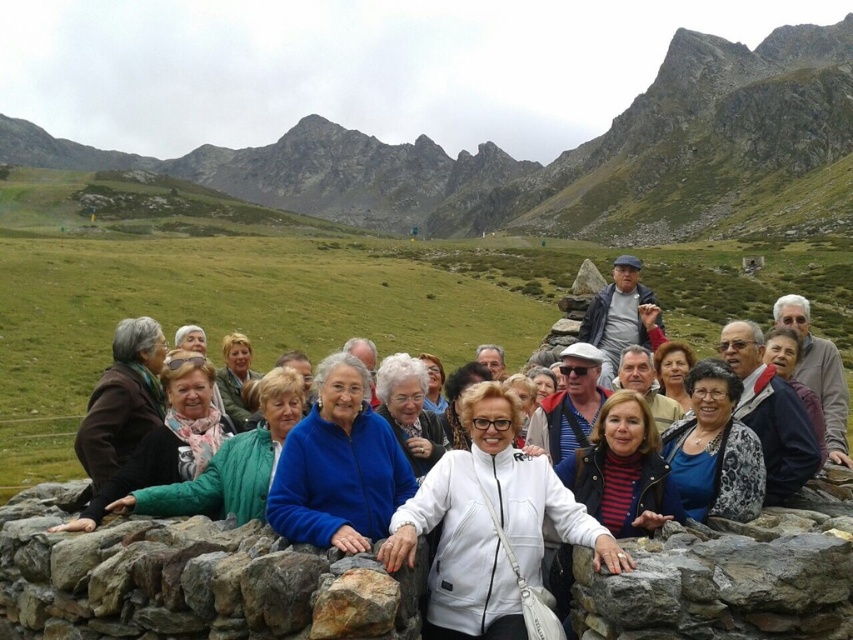
Is white matte jacket at center shorter than rough textured rock at center?

In fact, white matte jacket at center may be taller than rough textured rock at center.

Can you confirm if white matte jacket at center is smaller than rough textured rock at center?

No.

Where is `white matte jacket at center`? white matte jacket at center is located at coordinates (198, 586).

Based on the photo, between rough textured rock at center and gray rough stone at center, which one is positioned lower?

Positioned lower is gray rough stone at center.

Does point (97, 566) come in front of point (654, 572)?

No.

Identify the location of rough textured rock at center. (187, 580).

Is rugged stone mountain at center to the right of gray rough stone at center from the viewer's perspective?

No, rugged stone mountain at center is not to the right of gray rough stone at center.

Which is above, rugged stone mountain at center or gray rough stone at center?

rugged stone mountain at center is above.

Measure the distance between rugged stone mountain at center and camera.

The distance of rugged stone mountain at center from camera is 481.62 feet.

The height and width of the screenshot is (640, 853). Identify the location of rugged stone mountain at center. (567, 156).